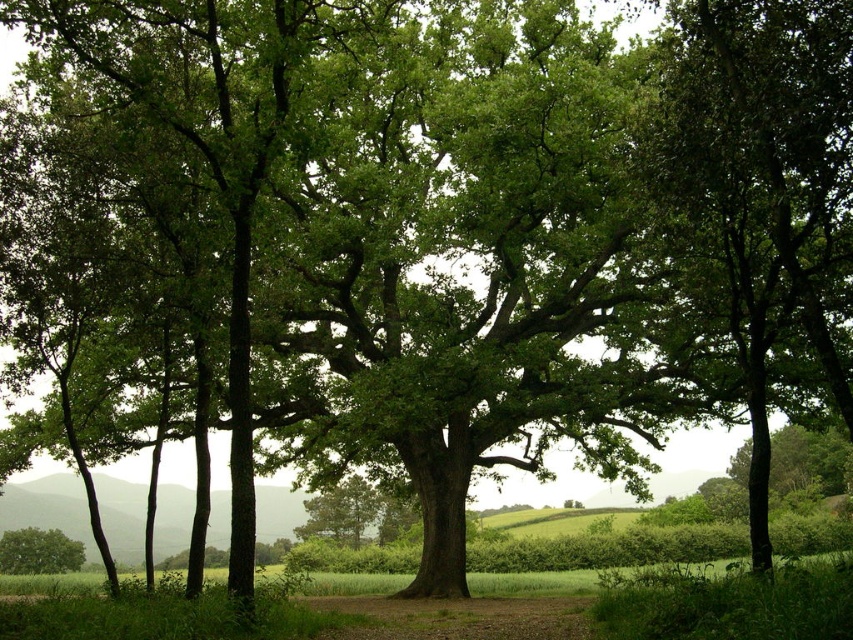
Who is taller, green leafy tree at center or green leafy tree at lower left?

green leafy tree at center is taller.

At what (x,y) coordinates should I click in order to perform the action: click on green leafy tree at center. Please return your answer as a coordinate pair (x, y). The image size is (853, 640). Looking at the image, I should click on (341, 512).